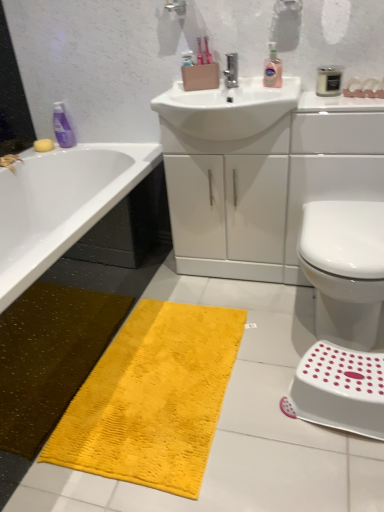
In order to click on blank space situated above white glossy bidet at lower right (from a real-world perspective) in this screenshot , I will do `click(351, 220)`.